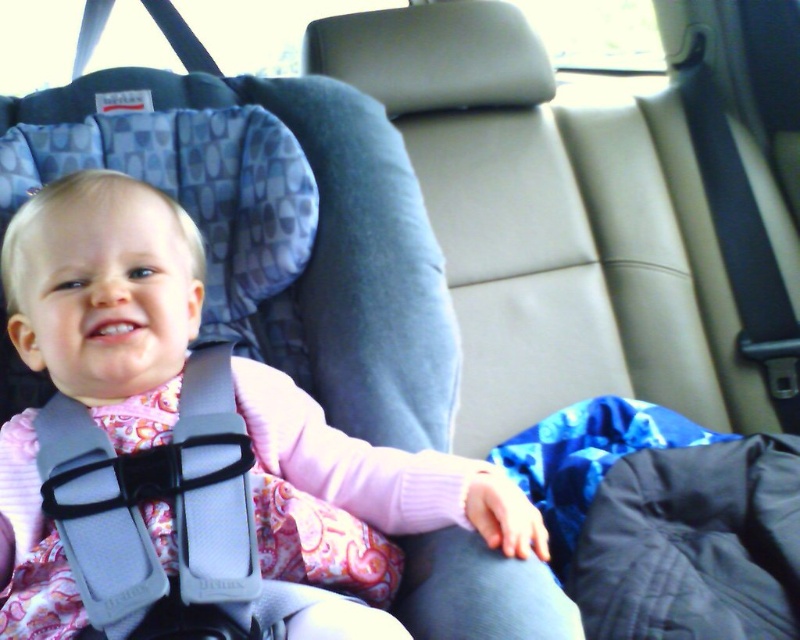
Question: Can you confirm if gray fabric strap at center is positioned to the right of gray fabric seatbelt at upper left?

Choices:
 (A) yes
 (B) no

Answer: (A)

Question: Which point appears farthest from the camera in this image?

Choices:
 (A) (212, 67)
 (B) (146, 596)

Answer: (A)

Question: Which of the following is the farthest from the observer?

Choices:
 (A) (126, 577)
 (B) (189, 54)

Answer: (B)

Question: Is gray fabric strap at center to the left of gray fabric seatbelt at upper left from the viewer's perspective?

Choices:
 (A) no
 (B) yes

Answer: (A)

Question: Which point is farther to the camera?

Choices:
 (A) gray fabric seatbelt at upper left
 (B) gray fabric strap at center

Answer: (A)

Question: Is gray fabric strap at center to the right of gray fabric seatbelt at upper left from the viewer's perspective?

Choices:
 (A) no
 (B) yes

Answer: (B)